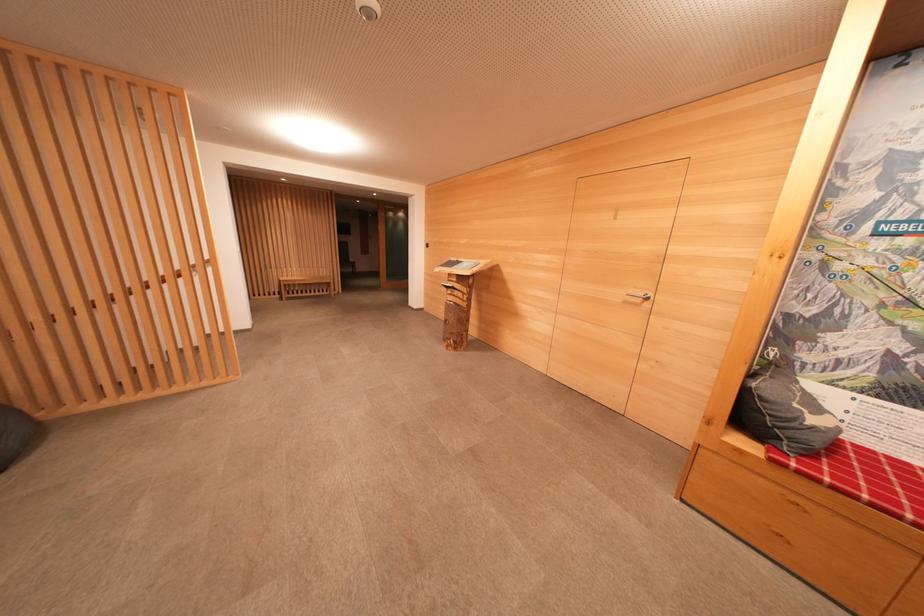
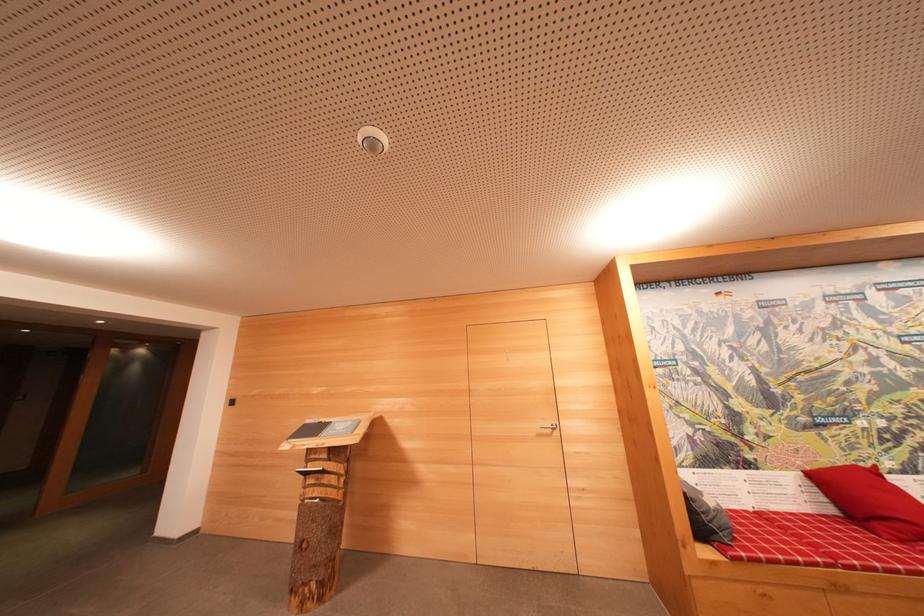
Locate, in the second image, the point that corresponds to point (793, 436) in the first image.

(720, 527)